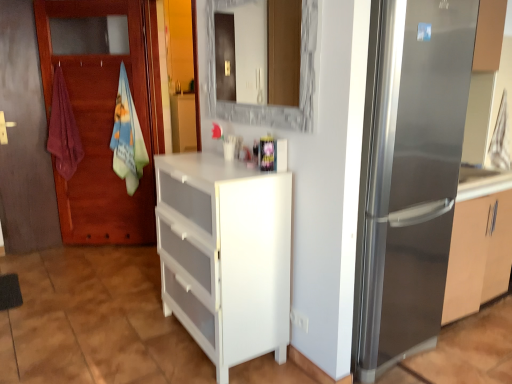
Question: From a real-world perspective, is white plastic chest of drawers at center on top of light blue cotton beach towel at left, which is counted as the 1th beach towel, starting from the right?

Choices:
 (A) yes
 (B) no

Answer: (B)

Question: Is white plastic chest of drawers at center directly adjacent to light blue cotton beach towel at left, the second beach towel in the left-to-right sequence?

Choices:
 (A) yes
 (B) no

Answer: (B)

Question: Is white plastic chest of drawers at center aimed at light blue cotton beach towel at left, the second beach towel in the left-to-right sequence?

Choices:
 (A) no
 (B) yes

Answer: (A)

Question: Does white plastic chest of drawers at center appear on the left side of light blue cotton beach towel at left, the second beach towel in the left-to-right sequence?

Choices:
 (A) no
 (B) yes

Answer: (A)

Question: Does white plastic chest of drawers at center have a larger size compared to light blue cotton beach towel at left, which is counted as the 1th beach towel, starting from the right?

Choices:
 (A) yes
 (B) no

Answer: (A)

Question: Is white plastic chest of drawers at center positioned with its back to light blue cotton beach towel at left, which is counted as the 1th beach towel, starting from the right?

Choices:
 (A) yes
 (B) no

Answer: (B)

Question: Is satin silver refrigerator at right outside of maroon cotton towel at left, positioned as the first beach towel in left-to-right order?

Choices:
 (A) yes
 (B) no

Answer: (A)

Question: Is satin silver refrigerator at right further to the viewer compared to maroon cotton towel at left, positioned as the first beach towel in left-to-right order?

Choices:
 (A) yes
 (B) no

Answer: (B)

Question: Is satin silver refrigerator at right not close to maroon cotton towel at left, positioned as the second beach towel in right-to-left order?

Choices:
 (A) no
 (B) yes

Answer: (B)

Question: From the image's perspective, is satin silver refrigerator at right over maroon cotton towel at left, positioned as the second beach towel in right-to-left order?

Choices:
 (A) yes
 (B) no

Answer: (B)

Question: Does satin silver refrigerator at right have a smaller size compared to maroon cotton towel at left, positioned as the second beach towel in right-to-left order?

Choices:
 (A) yes
 (B) no

Answer: (B)

Question: Does satin silver refrigerator at right appear on the left side of maroon cotton towel at left, positioned as the second beach towel in right-to-left order?

Choices:
 (A) no
 (B) yes

Answer: (A)

Question: Are satin silver refrigerator at right and white plastic chest of drawers at center far apart?

Choices:
 (A) no
 (B) yes

Answer: (A)